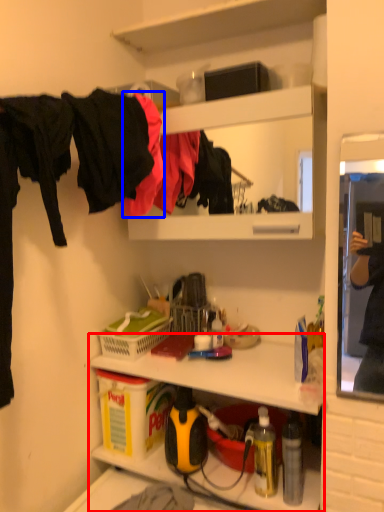
Question: Which object is further to the camera taking this photo, shelf (highlighted by a red box) or clothing (highlighted by a blue box)?

Choices:
 (A) shelf
 (B) clothing

Answer: (B)